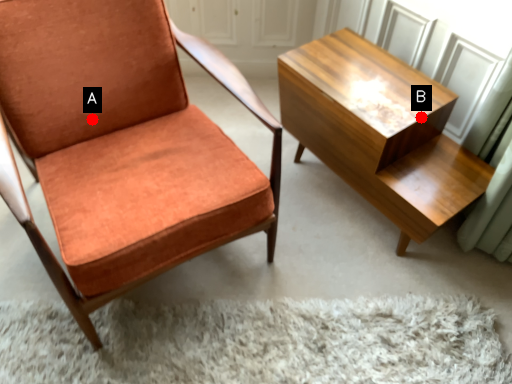
Question: Two points are circled on the image, labeled by A and B beside each circle. Among these points, which one is nearest to the camera?

Choices:
 (A) A is closer
 (B) B is closer

Answer: (B)